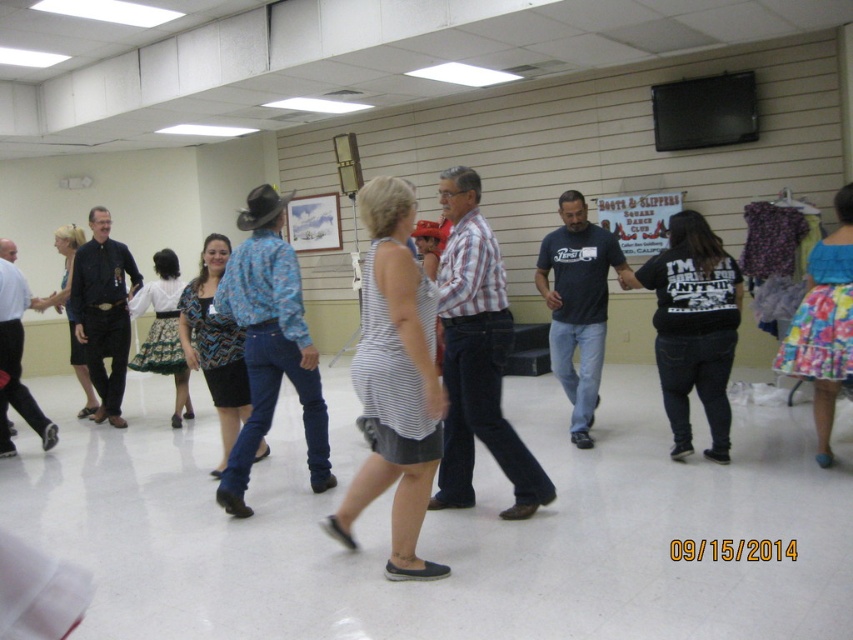
You are standing at the entrance of the dance hall and see two points marked on the floor. The first point is at position point (683, 224) and the second point is at point (233, 346). Which point is closer to you?

Point (683, 224) is in front of point (233, 346), so it is closer to you.

You are a photographer trying to capture the square dancing scene. You notice two people wearing a black matte shirt at left and a blue printed blouse at center. Which one is positioned higher in the image?

The black matte shirt at left is located above the blue printed blouse at center, so the person wearing the black matte shirt at left is positioned higher in the image.

You are a photographer standing at the back of the dance hall. You want to take a photo of the black matte shirt at center and the blue printed blouse at center. Which one will appear larger in your photo?

The black matte shirt at center will appear larger in the photo because it is closer to the viewer than the blue printed blouse at center.